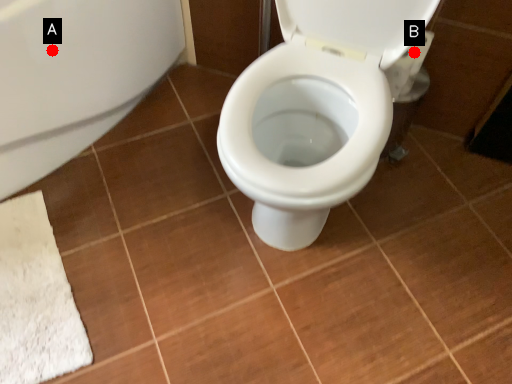
Question: Two points are circled on the image, labeled by A and B beside each circle. Which of the following is the farthest from the observer?

Choices:
 (A) A is further
 (B) B is further

Answer: (B)